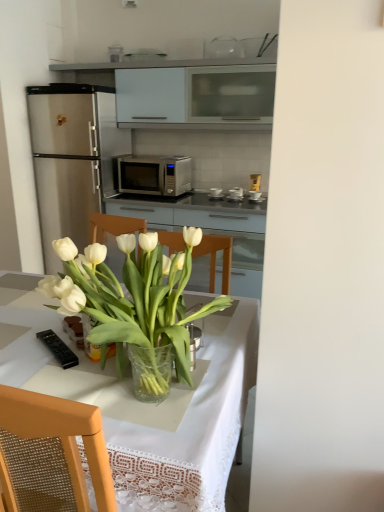
What do you see at coordinates (155, 175) in the screenshot?
I see `satin silver microwave at center` at bounding box center [155, 175].

The height and width of the screenshot is (512, 384). What do you see at coordinates (188, 92) in the screenshot?
I see `white matte cabinet at upper center` at bounding box center [188, 92].

Identify the location of satin silver microwave at center. (155, 175).

Considering the positions of objects satin silver microwave at center and translucent glass vase at center in the image provided, who is more to the right, satin silver microwave at center or translucent glass vase at center?

From the viewer's perspective, translucent glass vase at center appears more on the right side.

Which of these two, satin silver microwave at center or translucent glass vase at center, is thinner?

Thinner between the two is translucent glass vase at center.

Is satin silver microwave at center facing away from translucent glass vase at center?

satin silver microwave at center is not turned away from translucent glass vase at center.

Considering the sizes of objects metallic silver toaster at center, which ranks as the second appliance in left-to-right order, and translucent glass vase at center in the image provided, who is thinner, metallic silver toaster at center, which ranks as the second appliance in left-to-right order, or translucent glass vase at center?

metallic silver toaster at center, which ranks as the second appliance in left-to-right order, is thinner.

Is metallic silver toaster at center, arranged as the second appliance when viewed from the front, looking in the opposite direction of translucent glass vase at center?

No, metallic silver toaster at center, arranged as the second appliance when viewed from the front, is not facing the opposite direction of translucent glass vase at center.

Considering the relative positions of metallic silver toaster at center, positioned as the 2th appliance in bottom-to-top order, and translucent glass vase at center in the image provided, is metallic silver toaster at center, positioned as the 2th appliance in bottom-to-top order, to the left or to the right of translucent glass vase at center?

Based on their positions, metallic silver toaster at center, positioned as the 2th appliance in bottom-to-top order, is located to the right of translucent glass vase at center.

From a real-world perspective, who is located lower, metallic silver toaster at center, placed as the first appliance when sorted from back to front, or translucent glass vase at center?

From a 3D spatial view, metallic silver toaster at center, placed as the first appliance when sorted from back to front, is below.

Is black plastic remote control at lower left, which is counted as the second appliance, starting from the top, turned away from white matte cabinet at upper center?

black plastic remote control at lower left, which is counted as the second appliance, starting from the top, does not have its back to white matte cabinet at upper center.

Looking at this image, can you confirm if black plastic remote control at lower left, acting as the second appliance starting from the right, is taller than white matte cabinet at upper center?

In fact, black plastic remote control at lower left, acting as the second appliance starting from the right, may be shorter than white matte cabinet at upper center.

Where is `cabinetry behind the black plastic remote control at lower left, which is counted as the second appliance, starting from the top`? cabinetry behind the black plastic remote control at lower left, which is counted as the second appliance, starting from the top is located at coordinates (188, 92).

Between point (66, 358) and point (181, 106), which one is positioned behind?

The point (181, 106) is farther.

From the image's perspective, is translucent glass vase at center below transparent glass vase at center?

No.

In the image, is translucent glass vase at center on the left side or the right side of transparent glass vase at center?

Based on their positions, translucent glass vase at center is located to the right of transparent glass vase at center.

This screenshot has width=384, height=512. I want to click on houseplant to the right of transparent glass vase at center, so click(x=132, y=298).

Does translucent glass vase at center have a greater height compared to white matte cabinet at upper center?

In fact, translucent glass vase at center may be shorter than white matte cabinet at upper center.

Is translucent glass vase at center facing away from white matte cabinet at upper center?

No, translucent glass vase at center is not facing away from white matte cabinet at upper center.

From the image's perspective, which one is positioned lower, translucent glass vase at center or white matte cabinet at upper center?

translucent glass vase at center.

Visually, is translucent glass vase at center positioned to the left or to the right of satin silver microwave at center?

Based on their positions, translucent glass vase at center is located to the right of satin silver microwave at center.

Can you tell me how much translucent glass vase at center and satin silver microwave at center differ in facing direction?

87 degrees.

Can you confirm if translucent glass vase at center is smaller than satin silver microwave at center?

Actually, translucent glass vase at center might be larger than satin silver microwave at center.

Measure the distance from metallic silver toaster at center, positioned as the 2th appliance in bottom-to-top order, to transparent glass vase at center.

metallic silver toaster at center, positioned as the 2th appliance in bottom-to-top order, and transparent glass vase at center are 7.36 feet apart from each other.

From a real-world perspective, is metallic silver toaster at center, arranged as the 1th appliance when viewed from the top, on top of transparent glass vase at center?

Indeed, from a real-world perspective, metallic silver toaster at center, arranged as the 1th appliance when viewed from the top, stands above transparent glass vase at center.

Can you confirm if metallic silver toaster at center, placed as the first appliance when sorted from back to front, is taller than transparent glass vase at center?

No, metallic silver toaster at center, placed as the first appliance when sorted from back to front, is not taller than transparent glass vase at center.

Does point (230, 191) appear closer or farther from the camera than point (190, 292)?

Point (230, 191) is farther from the camera than point (190, 292).

This screenshot has width=384, height=512. In order to click on microwave oven above the translucent glass vase at center (from a real-world perspective) in this screenshot , I will do pos(155,175).

Where is `houseplant that is on the left side of metallic silver toaster at center, arranged as the second appliance when viewed from the front`? The width and height of the screenshot is (384, 512). houseplant that is on the left side of metallic silver toaster at center, arranged as the second appliance when viewed from the front is located at coordinates (132, 298).

Estimate the real-world distances between objects in this image. Which object is further from metallic silver toaster at center, placed as the first appliance when sorted from back to front, satin silver microwave at center or black plastic remote control at lower left, acting as the 1th appliance starting from the bottom?

black plastic remote control at lower left, acting as the 1th appliance starting from the bottom, lies further to metallic silver toaster at center, placed as the first appliance when sorted from back to front, than the other object.

Considering their positions, is white matte cabinet at upper center positioned closer to satin silver microwave at center than black plastic remote control at lower left, acting as the second appliance starting from the right?

The object closer to satin silver microwave at center is white matte cabinet at upper center.

When comparing their distances from satin silver microwave at center, does metallic silver toaster at center, placed as the first appliance when sorted from back to front, or black plastic remote control at lower left, which is counted as the second appliance, starting from the top, seem closer?

metallic silver toaster at center, placed as the first appliance when sorted from back to front, lies closer to satin silver microwave at center than the other object.

Which object lies nearer to the anchor point translucent glass vase at center, black plastic remote control at lower left, the first appliance viewed from the left, or satin silver microwave at center?

Among the two, black plastic remote control at lower left, the first appliance viewed from the left, is located nearer to translucent glass vase at center.

From the image, which object appears to be nearer to translucent glass vase at center, metallic silver toaster at center, arranged as the 1th appliance when viewed from the top, or black plastic remote control at lower left, which is counted as the second appliance, starting from the top?

black plastic remote control at lower left, which is counted as the second appliance, starting from the top, is positioned closer to the anchor translucent glass vase at center.

Which object lies further to the anchor point black plastic remote control at lower left, the first appliance viewed from the left, satin silver microwave at center or metallic silver toaster at center, the 1th appliance in the right-to-left sequence?

Based on the image, metallic silver toaster at center, the 1th appliance in the right-to-left sequence, appears to be further to black plastic remote control at lower left, the first appliance viewed from the left.

From the image, which object appears to be nearer to metallic silver toaster at center, which ranks as the second appliance in left-to-right order, black plastic remote control at lower left, acting as the 1th appliance starting from the bottom, or translucent glass vase at center?

black plastic remote control at lower left, acting as the 1th appliance starting from the bottom, is closer to metallic silver toaster at center, which ranks as the second appliance in left-to-right order.

Estimate the real-world distances between objects in this image. Which object is closer to satin silver microwave at center, translucent glass vase at center or white matte cabinet at upper center?

white matte cabinet at upper center is positioned closer to the anchor satin silver microwave at center.

Image resolution: width=384 pixels, height=512 pixels. I want to click on appliance between transparent glass vase at center and satin silver microwave at center from front to back, so click(58, 349).

The width and height of the screenshot is (384, 512). What are the coordinates of `cabinetry between transparent glass vase at center and metallic silver toaster at center, arranged as the 1th appliance when viewed from the top, in the front-back direction` in the screenshot? It's located at (188, 92).

At what (x,y) coordinates should I click in order to perform the action: click on houseplant between transparent glass vase at center and satin silver microwave at center along the z-axis. Please return your answer as a coordinate pair (x, y). Looking at the image, I should click on coord(132,298).

In order to click on appliance between translucent glass vase at center and transparent glass vase at center in the vertical direction in this screenshot , I will do `click(58, 349)`.